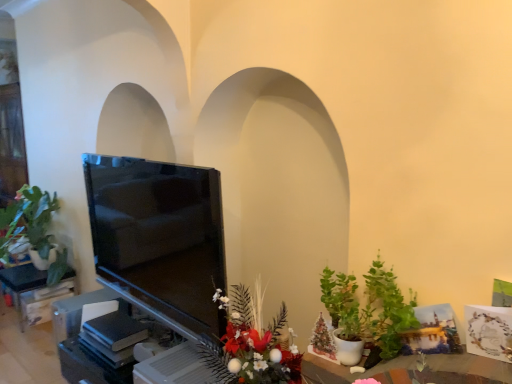
Question: Is point (27, 281) closer or farther from the camera than point (353, 329)?

Choices:
 (A) farther
 (B) closer

Answer: (A)

Question: From the image's perspective, is matte black tv at left above or below green matte plant at lower right, acting as the 1th houseplant starting from the front?

Choices:
 (A) below
 (B) above

Answer: (A)

Question: Which of these objects is positioned closest to the matte black tv at left?

Choices:
 (A) green matte plant at lower right, the 1th houseplant viewed from the right
 (B) green matte plant at left, the first houseplant when ordered from back to front
 (C) glossy floral arrangement at lower center
 (D) matte black tv at left

Answer: (B)

Question: Estimate the real-world distances between objects in this image. Which object is closer to the glossy floral arrangement at lower center?

Choices:
 (A) green matte plant at left, the 2th houseplant positioned from the front
 (B) matte black tv at left
 (C) matte black tv at left
 (D) green matte plant at lower right, the 2th houseplant viewed from the left

Answer: (D)